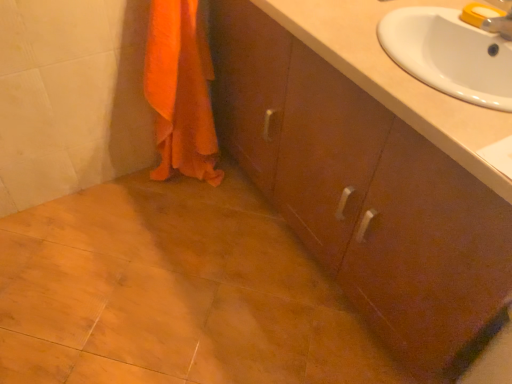
Image resolution: width=512 pixels, height=384 pixels. What are the coordinates of `vacant location below orange fabric towel at lower left (from a real-world perspective)` in the screenshot? It's located at (189, 182).